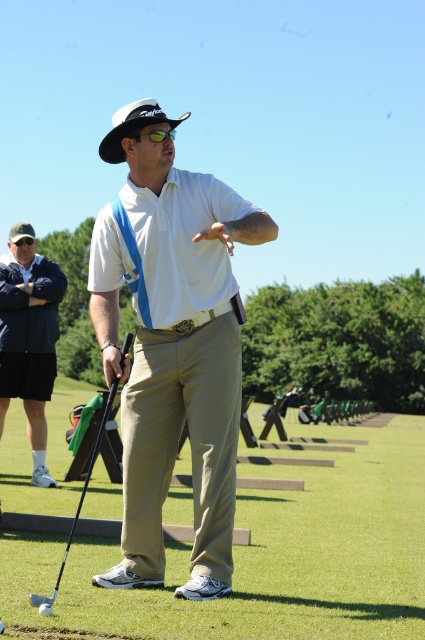
You are a photographer trying to capture the golfer in the scene. Which of the objects, the khaki fabric pants at center or the white matte shirt at center, would appear larger in your photo due to their position?

The khaki fabric pants at center would appear larger in the photo because it is closer to the viewer than the white matte shirt at center.

You are a golfer who wants to grab your golf club from the tee box. You see the matte black golf club at lower left and the shiny black golf club at center. Which one is closer to you?

The matte black golf club at lower left is closer to you because it is in front of the shiny black golf club at center.